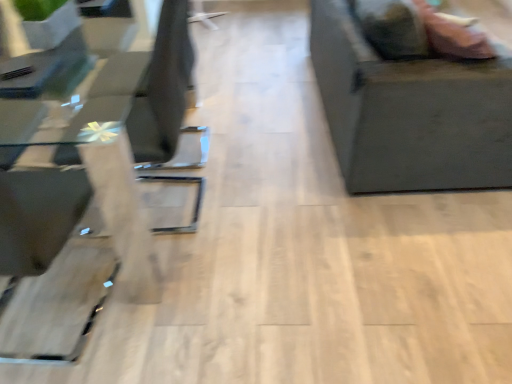
Measure the distance between matte black couch at right and camera.

1.68 meters.

Where is `matte black couch at right`? matte black couch at right is located at coordinates (410, 112).

What do you see at coordinates (410, 112) in the screenshot? The image size is (512, 384). I see `matte black couch at right` at bounding box center [410, 112].

At what (x,y) coordinates should I click in order to perform the action: click on transparent glass table at left. Please return your answer as a coordinate pair (x, y). The width and height of the screenshot is (512, 384). Looking at the image, I should click on (85, 191).

This screenshot has width=512, height=384. Describe the element at coordinates (85, 191) in the screenshot. I see `transparent glass table at left` at that location.

Identify the location of matte black couch at right. click(410, 112).

Does transparent glass table at left appear on the left side of matte black couch at right?

Yes.

Is transparent glass table at left further to camera compared to matte black couch at right?

No, transparent glass table at left is closer to the viewer.

Considering the positions of point (37, 305) and point (332, 19), is point (37, 305) closer or farther from the camera than point (332, 19)?

Point (37, 305) appears to be closer to the viewer than point (332, 19).

From the image's perspective, is transparent glass table at left under matte black couch at right?

Yes.

From a real-world perspective, which is physically above, transparent glass table at left or matte black couch at right?

matte black couch at right.

Which of these two, transparent glass table at left or matte black couch at right, is thinner?

transparent glass table at left is thinner.

Based on the photo, is transparent glass table at left taller or shorter than matte black couch at right?

In the image, transparent glass table at left appears to be shorter than matte black couch at right.

Which of these two, transparent glass table at left or matte black couch at right, is bigger?

matte black couch at right is bigger.

Choose the correct answer: Is transparent glass table at left inside matte black couch at right or outside it?

transparent glass table at left is not inside matte black couch at right, it's outside.

Looking at this image, are transparent glass table at left and matte black couch at right far apart?

That's right, there is a large distance between transparent glass table at left and matte black couch at right.

Is transparent glass table at left oriented towards matte black couch at right?

Yes, transparent glass table at left faces towards matte black couch at right.

From the picture: Measure the distance from transparent glass table at left to matte black couch at right.

transparent glass table at left and matte black couch at right are 4.23 feet apart.

The image size is (512, 384). In order to click on furniture that is on the right side of transparent glass table at left in this screenshot , I will do `click(410, 112)`.

Can you confirm if matte black couch at right is positioned to the right of transparent glass table at left?

Yes.

Considering their positions, is matte black couch at right located in front of or behind transparent glass table at left?

matte black couch at right is behind transparent glass table at left.

Which point is more forward, (396, 62) or (3, 251)?

Positioned in front is point (3, 251).

From the image's perspective, is matte black couch at right located above or below transparent glass table at left?

matte black couch at right is above transparent glass table at left.

From a real-world perspective, who is located lower, matte black couch at right or transparent glass table at left?

transparent glass table at left.

Considering the relative sizes of matte black couch at right and transparent glass table at left in the image provided, is matte black couch at right thinner than transparent glass table at left?

No, matte black couch at right is not thinner than transparent glass table at left.

Considering the sizes of objects matte black couch at right and transparent glass table at left in the image provided, who is shorter, matte black couch at right or transparent glass table at left?

transparent glass table at left is shorter.

Considering the relative sizes of matte black couch at right and transparent glass table at left in the image provided, is matte black couch at right bigger than transparent glass table at left?

Yes, matte black couch at right is bigger than transparent glass table at left.

Consider the image. Is matte black couch at right situated inside transparent glass table at left or outside?

The correct answer is: outside.

Is matte black couch at right not close to transparent glass table at left?

matte black couch at right is far away from transparent glass table at left.

In the scene shown: Is matte black couch at right looking in the opposite direction of transparent glass table at left?

Yes, matte black couch at right is facing away from transparent glass table at left.

Can you tell me how much matte black couch at right and transparent glass table at left differ in facing direction?

They differ by 0.947 degrees in their facing directions.

I want to click on table in front of the matte black couch at right, so click(x=85, y=191).

You are a GUI agent. You are given a task and a screenshot of the screen. Output one action in this format:
    pyautogui.click(x=<x>, y=<y>)
    Task: Click on the furniture that appears on the right of transparent glass table at left
    The height and width of the screenshot is (384, 512).
    Given the screenshot: What is the action you would take?
    pyautogui.click(x=410, y=112)

Locate an element on the screen. table that is in front of the matte black couch at right is located at coordinates (85, 191).